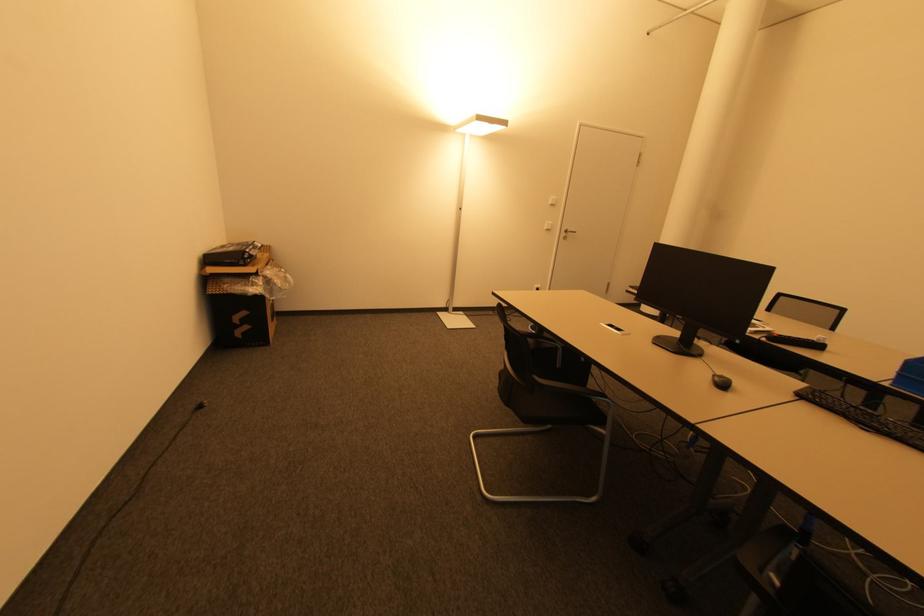
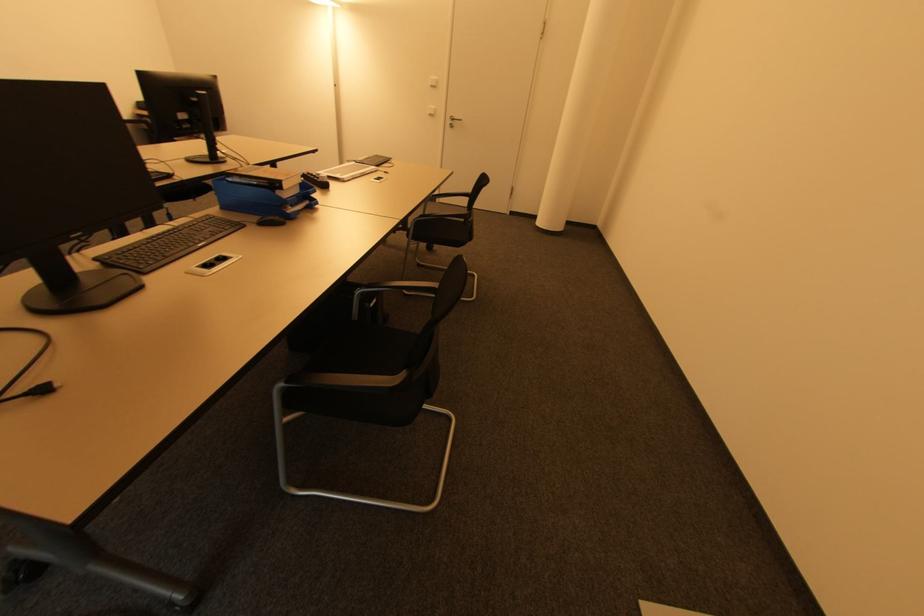
Locate, in the second image, the point that corresponds to (566,238) in the first image.

(454, 127)